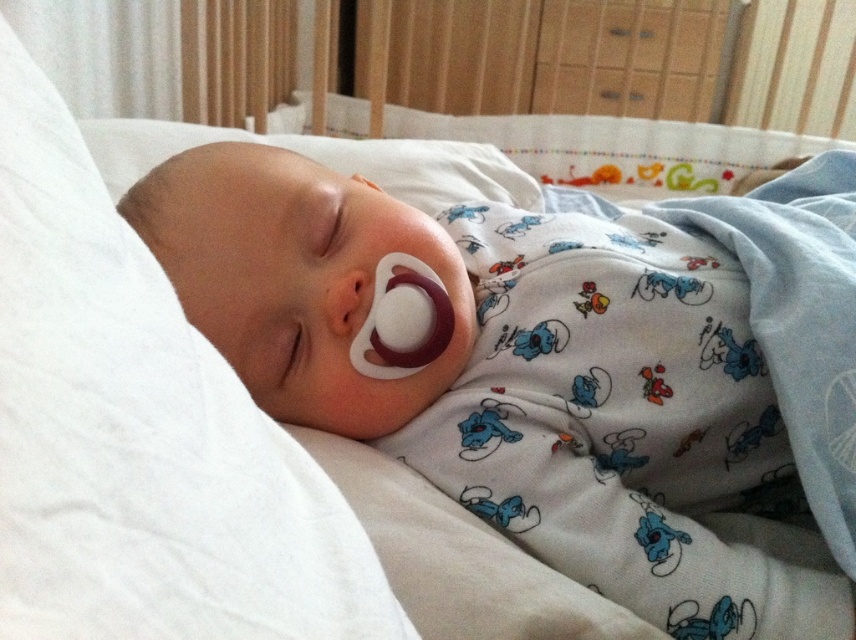
Does white soft pacifier at center lie in front of smooth white pacifier at center?

Yes, white soft pacifier at center is closer to the viewer.

Who is lower down, white soft pacifier at center or smooth white pacifier at center?

smooth white pacifier at center

The height and width of the screenshot is (640, 856). What do you see at coordinates (518, 376) in the screenshot? I see `white soft pacifier at center` at bounding box center [518, 376].

This screenshot has width=856, height=640. Find the location of `white soft pacifier at center`. white soft pacifier at center is located at coordinates (518, 376).